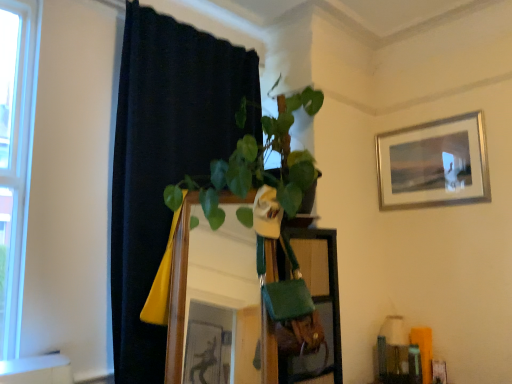
What is the approximate height of green fabric bag at center?

green fabric bag at center is 89.33 centimeters tall.

Describe the element at coordinates (434, 164) in the screenshot. Image resolution: width=512 pixels, height=384 pixels. I see `silver metallic picture frame at upper right` at that location.

What do you see at coordinates (206, 276) in the screenshot?
I see `wooden mirror at center` at bounding box center [206, 276].

Describe the element at coordinates (165, 159) in the screenshot. I see `black fabric curtain at left` at that location.

From the picture: In order to face black fabric curtain at left, should I rotate leftwards or rightwards?

A 7.594 degree turn to the left will do.

Find the location of `green fabric bag at center`. green fabric bag at center is located at coordinates (300, 306).

From the picture: Does green fabric bag at center have a smaller size compared to black fabric curtain at left?

Yes.

Can you confirm if green fabric bag at center is thinner than black fabric curtain at left?

In fact, green fabric bag at center might be wider than black fabric curtain at left.

Is green fabric bag at center aimed at black fabric curtain at left?

No.

How many degrees apart are the facing directions of green fabric bag at center and black fabric curtain at left?

The angle between the facing direction of green fabric bag at center and the facing direction of black fabric curtain at left is 9.32 degrees.

Is black fabric curtain at left with wooden mirror at center?

No, black fabric curtain at left is not touching wooden mirror at center.

Locate an element on the screen. The width and height of the screenshot is (512, 384). mirror on the right of black fabric curtain at left is located at coordinates (206, 276).

Between black fabric curtain at left and wooden mirror at center, which one has smaller width?

Thinner between the two is black fabric curtain at left.

From the picture: Is black fabric curtain at left not inside wooden mirror at center?

Indeed, black fabric curtain at left is completely outside wooden mirror at center.

Can you tell me how much silver metallic picture frame at upper right and black fabric curtain at left differ in facing direction?

96.6 degrees separate the facing orientations of silver metallic picture frame at upper right and black fabric curtain at left.

Where is `picture frame on the right of black fabric curtain at left`? The width and height of the screenshot is (512, 384). picture frame on the right of black fabric curtain at left is located at coordinates (434, 164).

From a real-world perspective, is silver metallic picture frame at upper right on top of black fabric curtain at left?

Yes, from a real-world perspective, silver metallic picture frame at upper right is above black fabric curtain at left.

Does silver metallic picture frame at upper right have a lesser width compared to black fabric curtain at left?

Correct, the width of silver metallic picture frame at upper right is less than that of black fabric curtain at left.

Relative to green fabric bag at center, is silver metallic picture frame at upper right in front or behind?

silver metallic picture frame at upper right is positioned farther from the viewer than green fabric bag at center.

Is there a large distance between silver metallic picture frame at upper right and green fabric bag at center?

Absolutely, silver metallic picture frame at upper right is distant from green fabric bag at center.

How different are the orientations of silver metallic picture frame at upper right and green fabric bag at center in degrees?

silver metallic picture frame at upper right and green fabric bag at center are facing 87.3 degrees away from each other.

Is green fabric bag at center located outside silver metallic picture frame at upper right?

Yes.

What's the angular difference between green fabric bag at center and silver metallic picture frame at upper right's facing directions?

87.3 degrees.

Is point (287, 345) closer or farther from the camera than point (460, 157)?

Clearly, point (287, 345) is closer to the camera than point (460, 157).

Which of these two, green fabric bag at center or silver metallic picture frame at upper right, stands taller?

Standing taller between the two is green fabric bag at center.

I want to click on curtain lying above the green fabric bag at center (from the image's perspective), so [165, 159].

Would you say black fabric curtain at left is a long distance from green fabric bag at center?

That's not correct — black fabric curtain at left is a little close to green fabric bag at center.

From the image's perspective, is black fabric curtain at left over green fabric bag at center?

Yes, from the image's perspective, black fabric curtain at left is over green fabric bag at center.

From the picture: Which is in front, black fabric curtain at left or green fabric bag at center?

black fabric curtain at left is more forward.

Is green fabric bag at center directly adjacent to wooden mirror at center?

green fabric bag at center and wooden mirror at center are clearly separated.

Between point (284, 285) and point (182, 320), which one is positioned behind?

The point (284, 285) is more distant.

From the image's perspective, is green fabric bag at center located above or below wooden mirror at center?

green fabric bag at center is below wooden mirror at center.

Is green fabric bag at center looking in the opposite direction of wooden mirror at center?

No, wooden mirror at center is not at the back of green fabric bag at center.

At what (x,y) coordinates should I click in order to perform the action: click on curtain that appears above the green fabric bag at center (from a real-world perspective). Please return your answer as a coordinate pair (x, y). Looking at the image, I should click on (165, 159).

Identify the location of curtain behind the wooden mirror at center. (165, 159).

Estimate the real-world distances between objects in this image. Which object is further from wooden mirror at center, black fabric curtain at left or silver metallic picture frame at upper right?

Among the two, silver metallic picture frame at upper right is located further to wooden mirror at center.

Based on their spatial positions, is wooden mirror at center or silver metallic picture frame at upper right closer to black fabric curtain at left?

wooden mirror at center is positioned closer to the anchor black fabric curtain at left.

When comparing their distances from wooden mirror at center, does green fabric bag at center or black fabric curtain at left seem further?

Based on the image, black fabric curtain at left appears to be further to wooden mirror at center.

Estimate the real-world distances between objects in this image. Which object is further from silver metallic picture frame at upper right, wooden mirror at center or black fabric curtain at left?

wooden mirror at center is further to silver metallic picture frame at upper right.

When comparing their distances from green fabric bag at center, does black fabric curtain at left or wooden mirror at center seem further?

Based on the image, black fabric curtain at left appears to be further to green fabric bag at center.

When comparing their distances from black fabric curtain at left, does green fabric bag at center or silver metallic picture frame at upper right seem closer?

green fabric bag at center is closer to black fabric curtain at left.

Considering their positions, is black fabric curtain at left positioned further to green fabric bag at center than silver metallic picture frame at upper right?

silver metallic picture frame at upper right is positioned further to the anchor green fabric bag at center.

Which object lies nearer to the anchor point black fabric curtain at left, green fabric bag at center or wooden mirror at center?

wooden mirror at center is positioned closer to the anchor black fabric curtain at left.

The image size is (512, 384). I want to click on mirror between black fabric curtain at left and green fabric bag at center vertically, so click(206, 276).

Find the location of a particular element. mirror situated between black fabric curtain at left and silver metallic picture frame at upper right from left to right is located at coordinates (206, 276).

Find the location of a particular element. The height and width of the screenshot is (384, 512). shelf between black fabric curtain at left and silver metallic picture frame at upper right from left to right is located at coordinates (300, 306).

Where is `shelf between wooden mirror at center and silver metallic picture frame at upper right in the horizontal direction`? This screenshot has height=384, width=512. shelf between wooden mirror at center and silver metallic picture frame at upper right in the horizontal direction is located at coordinates (300, 306).